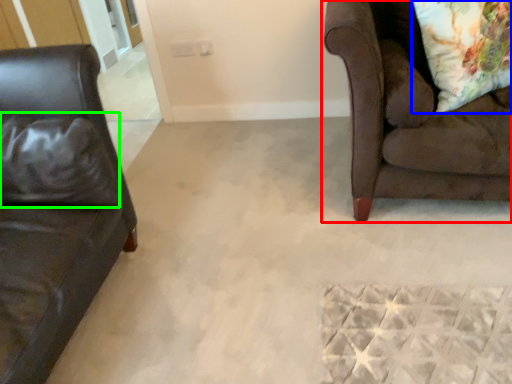
Question: Which object is the closest to the studio couch (highlighted by a red box)? Choose among these: throw pillow (highlighted by a blue box) or pillow (highlighted by a green box).

Choices:
 (A) throw pillow
 (B) pillow

Answer: (A)